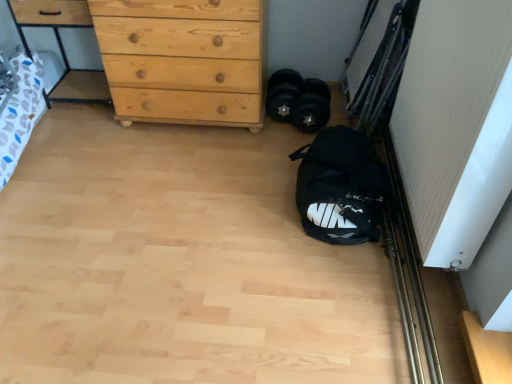
Identify the location of vacant space in between natural wood dresser at upper left and natural wood chest of drawers at upper left. The height and width of the screenshot is (384, 512). (88, 114).